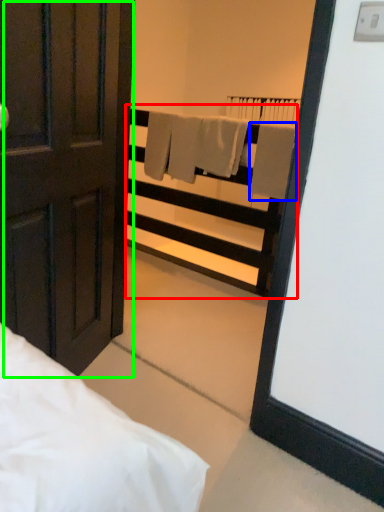
Question: Considering the real-world distances, which object is closest to balustrade (highlighted by a red box)? bath towel (highlighted by a blue box) or door (highlighted by a green box).

Choices:
 (A) bath towel
 (B) door

Answer: (A)